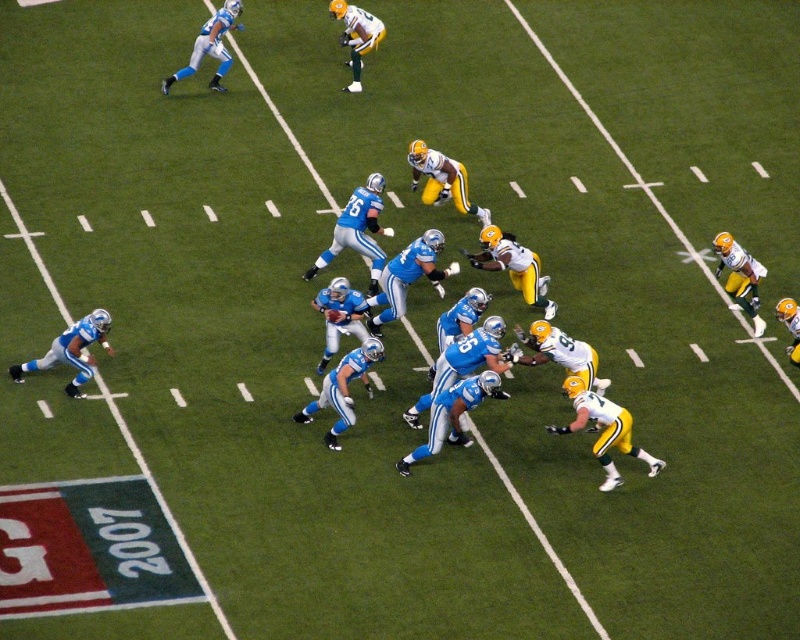
Does point (462, 182) come closer to viewer compared to point (350, 88)?

Yes, point (462, 182) is in front of point (350, 88).

Which is above, yellow-green uniform at center or yellow-green jersey at upper center?

yellow-green jersey at upper center is higher up.

Does point (468, 200) come closer to viewer compared to point (360, 33)?

That is True.

Where is `yellow-green uniform at center`? Image resolution: width=800 pixels, height=640 pixels. yellow-green uniform at center is located at coordinates (442, 179).

Who is positioned more to the left, blue matte jersey at center or green matte jersey at right?

From the viewer's perspective, blue matte jersey at center appears more on the left side.

Find the location of a particular element. This screenshot has width=800, height=640. blue matte jersey at center is located at coordinates (604, 432).

Is point (596, 408) closer to camera compared to point (725, 240)?

That is True.

At what (x,y) coordinates should I click in order to perform the action: click on blue matte jersey at center. Please return your answer as a coordinate pair (x, y). Looking at the image, I should click on 604,432.

Identify the location of yellow-green uniform at center. (442, 179).

Locate an element on the screen. yellow-green uniform at center is located at coordinates (442, 179).